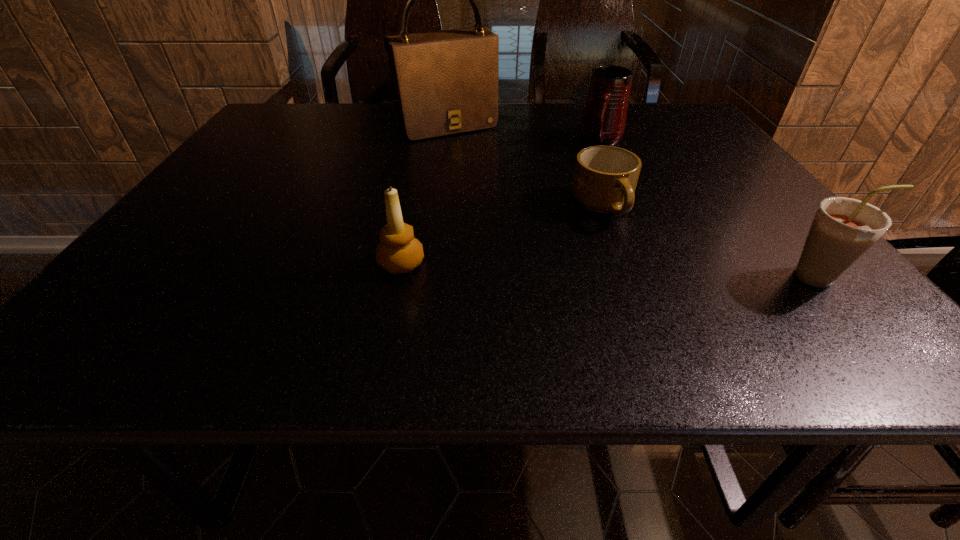
The image size is (960, 540). Identify the location of vacant area that lies between the candle_holder and the rightmost object. (612, 271).

I want to click on unoccupied position between the root beer and the farther mug, so click(711, 209).

Locate an element on the screen. This screenshot has width=960, height=540. vacant area between the rightmost object and the tallest object is located at coordinates (635, 201).

In order to click on free space between the rightmost object and the tallest object in this screenshot , I will do `click(635, 201)`.

Locate an element on the screen. free space between the candle_holder and the shoulder bag is located at coordinates (424, 195).

This screenshot has height=540, width=960. Find the location of `the fourth closest object to the root beer`. the fourth closest object to the root beer is located at coordinates (445, 82).

Point out which object is positioned as the third nearest to the nearer mug. Please provide its 2D coordinates. Your answer should be formatted as a tuple, i.e. [(x, y)], where the tuple contains the x and y coordinates of a point satisfying the conditions above.

[(445, 82)]

Locate an element on the screen. The image size is (960, 540). vacant area that satisfies the following two spatial constraints: 1. on the front side of the taller mug; 2. on the drink side of the root beer is located at coordinates (664, 276).

This screenshot has width=960, height=540. I want to click on vacant space that satisfies the following two spatial constraints: 1. on the front side of the taller mug; 2. on the drink side of the rightmost object, so click(664, 276).

Locate an element on the screen. This screenshot has height=540, width=960. vacant space that satisfies the following two spatial constraints: 1. on the back side of the candle_holder; 2. on the left side of the tallest object is located at coordinates (429, 126).